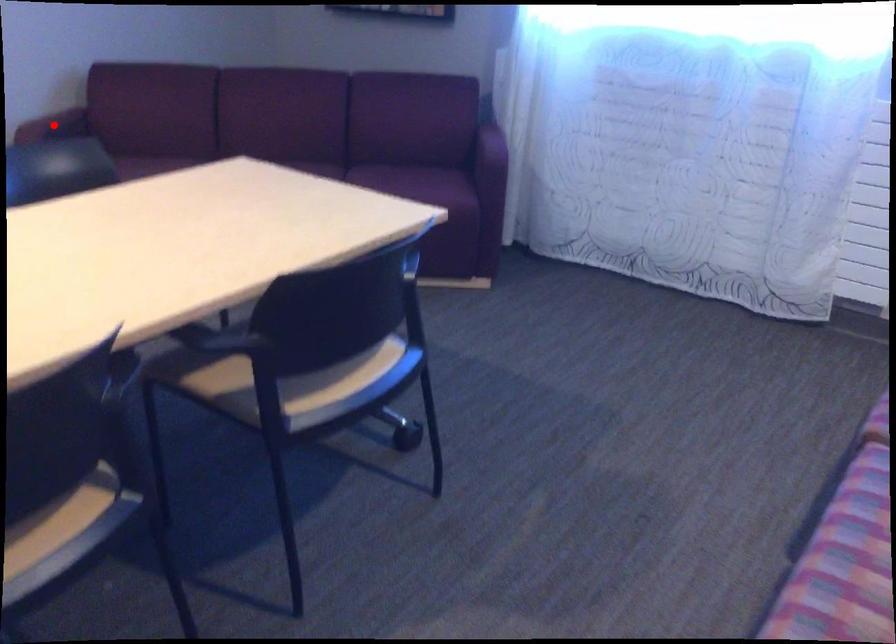
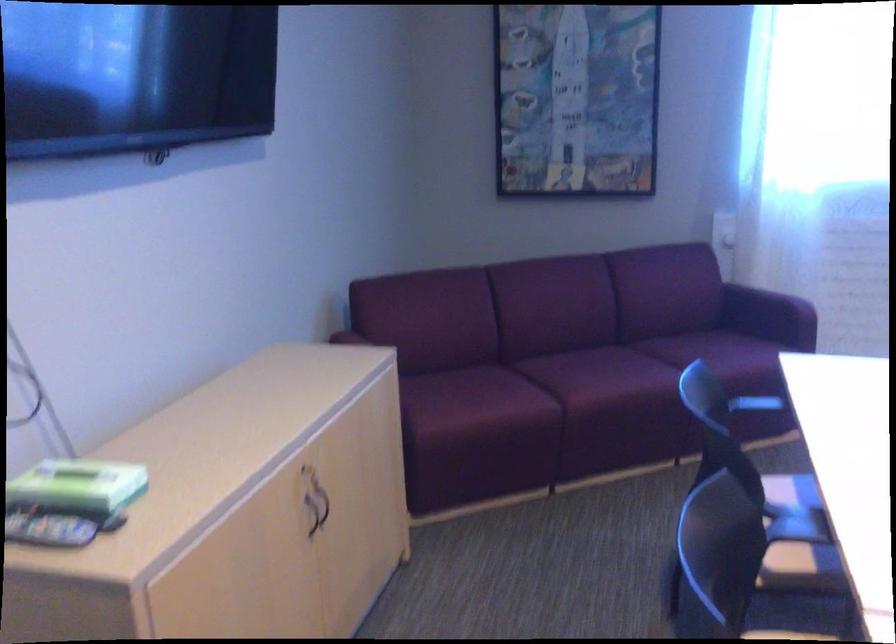
Question: I am providing you with two images of the same scene from different viewpoints. A red point is marked on the first image. Can you still see the location of the red point in image 2?

Choices:
 (A) Yes
 (B) No

Answer: (B)